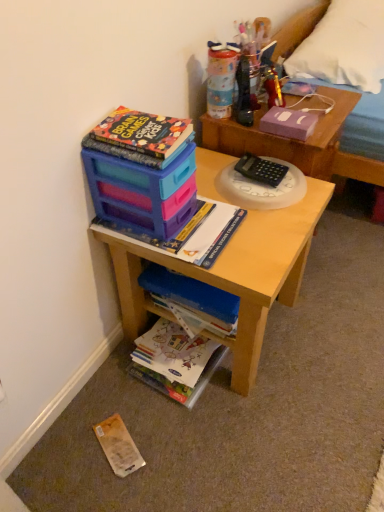
Where is `free space to the back side of yellow paper at lower left, arranged as the first paperback book when ordered from the bottom`? free space to the back side of yellow paper at lower left, arranged as the first paperback book when ordered from the bottom is located at coordinates (115, 394).